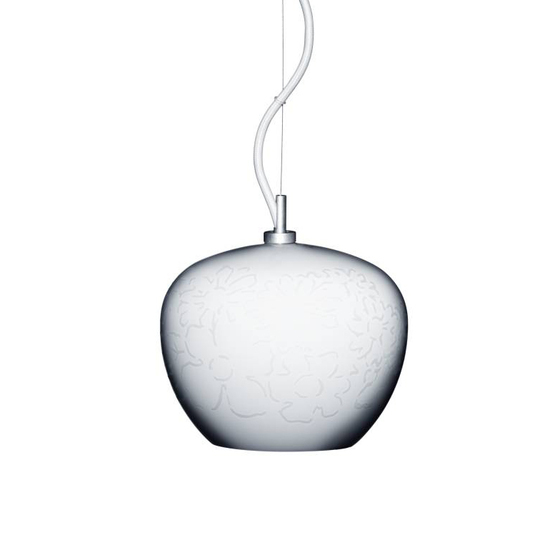
At what (x,y) coordinates should I click in order to perform the action: click on space right of lamp. Please return your answer as a coordinate pair (x, y). This screenshot has width=560, height=560. Looking at the image, I should click on (473, 306).